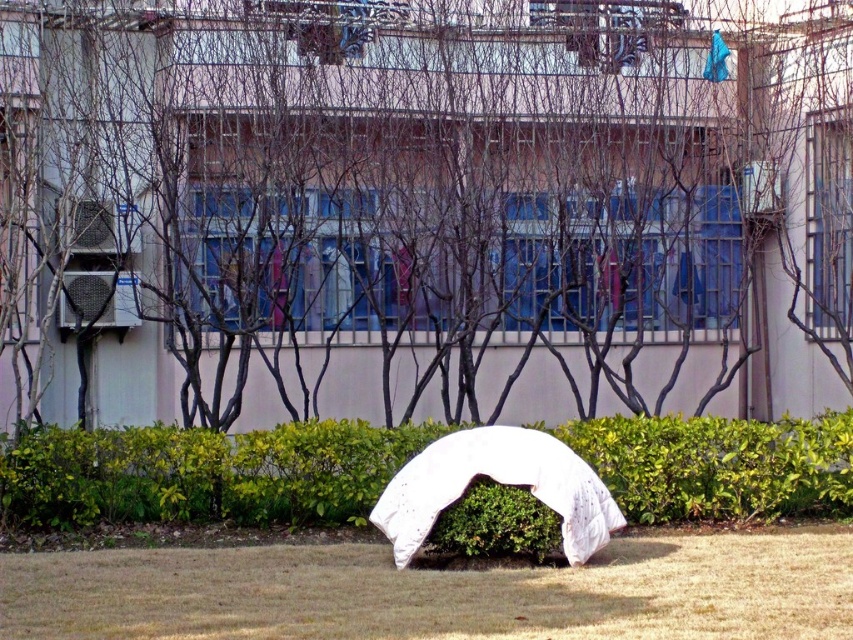
Which is behind, point (695, 280) or point (170, 445)?

The point (695, 280) is behind.

Can you confirm if white fabric umbrella at center is positioned above green leafy hedge at center?

Yes, white fabric umbrella at center is above green leafy hedge at center.

Image resolution: width=853 pixels, height=640 pixels. In order to click on white fabric umbrella at center in this screenshot , I will do `click(422, 205)`.

Locate an element on the screen. white fabric umbrella at center is located at coordinates (422, 205).

Who is taller, white fabric umbrella at center or dry grass at center?

Standing taller between the two is white fabric umbrella at center.

Can you confirm if white fabric umbrella at center is positioned to the right of dry grass at center?

No, white fabric umbrella at center is not to the right of dry grass at center.

Does point (196, 64) lie in front of point (810, 540)?

No, it is not.

Where is `white fabric umbrella at center`? This screenshot has height=640, width=853. white fabric umbrella at center is located at coordinates (422, 205).

Describe the element at coordinates (439, 592) in the screenshot. I see `dry grass at center` at that location.

Is dry grass at center thinner than green leafy bush at center?

No, dry grass at center is not thinner than green leafy bush at center.

Is point (291, 620) behind point (454, 506)?

No, (291, 620) is closer to viewer.

Locate an element on the screen. dry grass at center is located at coordinates (439, 592).